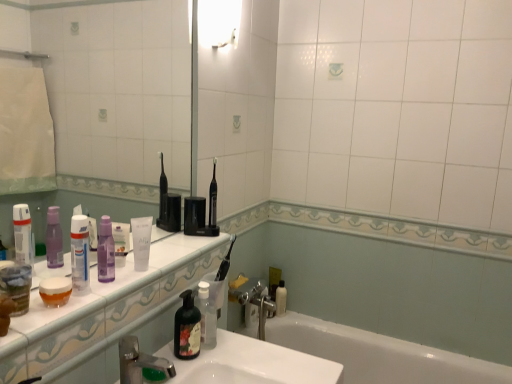
You are a GUI agent. You are given a task and a screenshot of the screen. Output one action in this format:
    pyautogui.click(x=<x>, y=<y>)
    Task: Click on the free space to the right of white matte bottle at lower center, the fifth toiletry when ordered from front to back
    This screenshot has width=512, height=384.
    Given the screenshot: What is the action you would take?
    pyautogui.click(x=304, y=317)